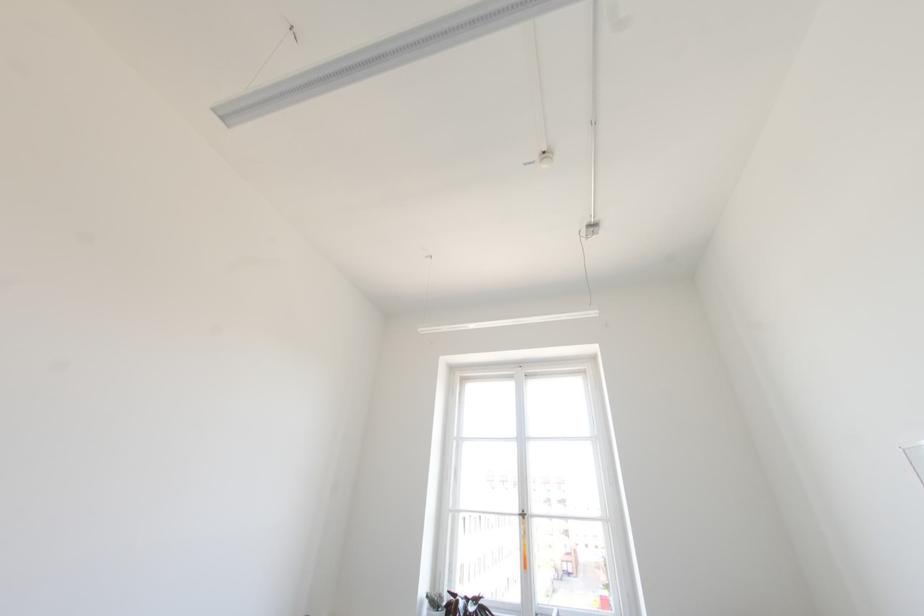
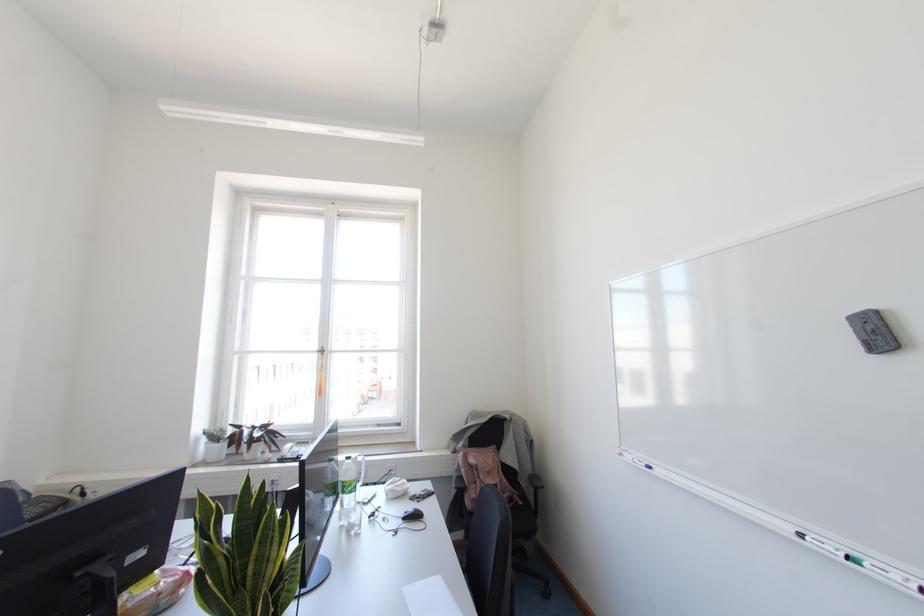
Locate, in the second image, the point that corresponds to (x=523, y=517) in the first image.

(322, 353)